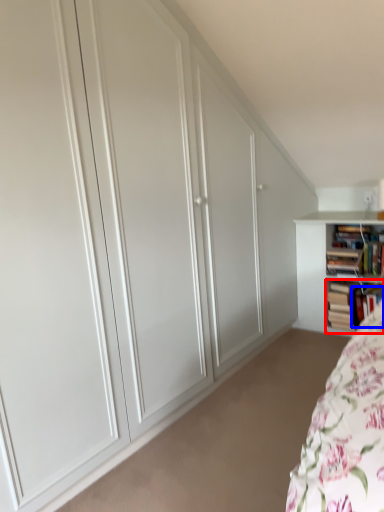
Question: Which object is further to the camera taking this photo, book (highlighted by a red box) or book (highlighted by a blue box)?

Choices:
 (A) book
 (B) book

Answer: (A)